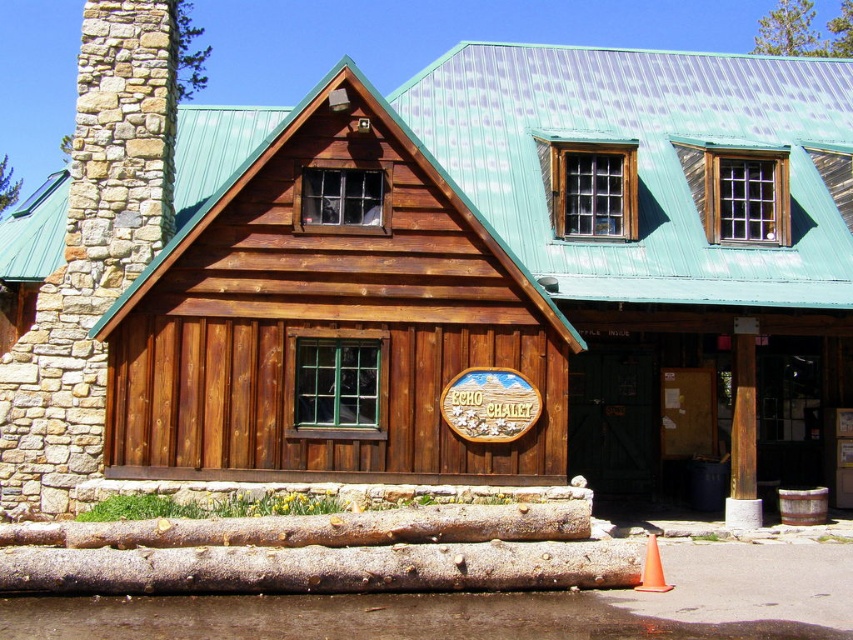
Question: Is stained wood cabin at center behind orange plastic cone at lower center?

Choices:
 (A) no
 (B) yes

Answer: (B)

Question: Is stained wood cabin at center smaller than orange plastic cone at lower center?

Choices:
 (A) no
 (B) yes

Answer: (B)

Question: Which of the following is the farthest from the observer?

Choices:
 (A) (300, 291)
 (B) (646, 572)

Answer: (A)

Question: Where is stained wood cabin at center located in relation to orange plastic cone at lower center in the image?

Choices:
 (A) left
 (B) right

Answer: (A)